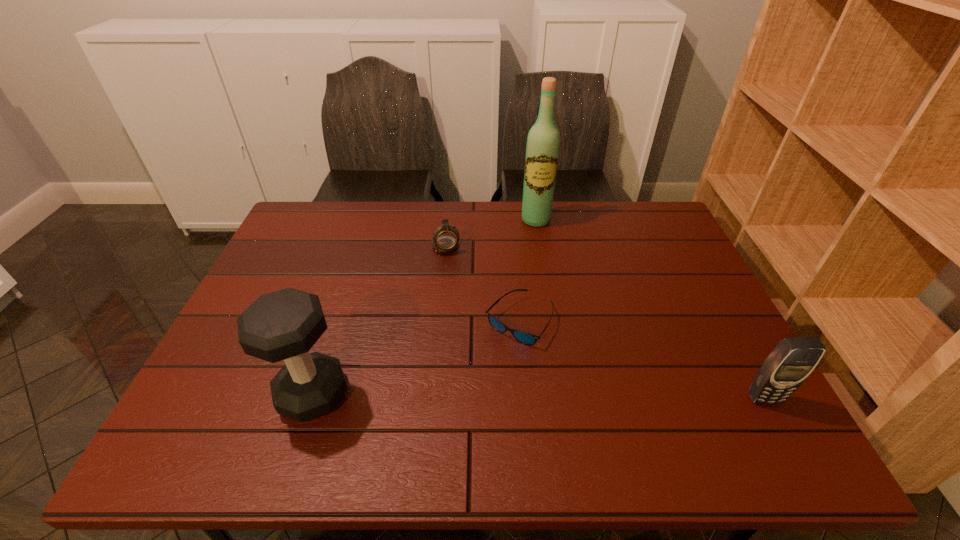
Locate an element on the screen. compass that is at the far edge is located at coordinates (445, 238).

You are a GUI agent. You are given a task and a screenshot of the screen. Output one action in this format:
    pyautogui.click(x=<x>, y=<y>)
    Task: Click on the wine bottle present at the far edge
    
    Given the screenshot: What is the action you would take?
    pyautogui.click(x=543, y=142)

Locate an element on the screen. dumbbell that is at the near edge is located at coordinates (283, 325).

Where is `cellular telephone situated at the near edge`? The width and height of the screenshot is (960, 540). cellular telephone situated at the near edge is located at coordinates (784, 370).

At what (x,y) coordinates should I click in order to perform the action: click on object present at the right edge. Please return your answer as a coordinate pair (x, y). The width and height of the screenshot is (960, 540). Looking at the image, I should click on (784, 370).

What are the coordinates of `object present at the near right corner` in the screenshot? It's located at (784, 370).

At what (x,y) coordinates should I click in order to perform the action: click on vacant area at the far edge of the desktop. Please return your answer as a coordinate pair (x, y). Image resolution: width=960 pixels, height=540 pixels. Looking at the image, I should click on (396, 233).

I want to click on vacant space at the near edge of the desktop, so click(365, 406).

Image resolution: width=960 pixels, height=540 pixels. I want to click on vacant space at the left edge of the desktop, so click(275, 270).

At what (x,y) coordinates should I click in order to perform the action: click on vacant space at the right edge of the desktop. Please return your answer as a coordinate pair (x, y). Looking at the image, I should click on (647, 246).